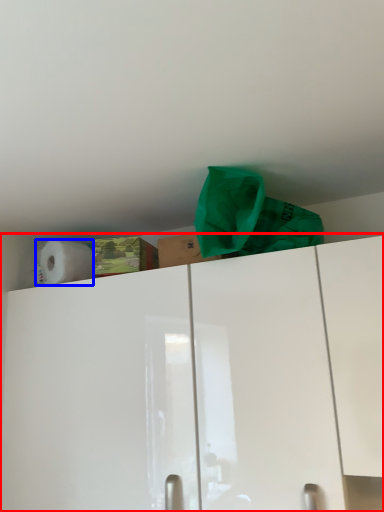
Question: Which object is further to the camera taking this photo, cabinetry (highlighted by a red box) or paper towel (highlighted by a blue box)?

Choices:
 (A) cabinetry
 (B) paper towel

Answer: (B)